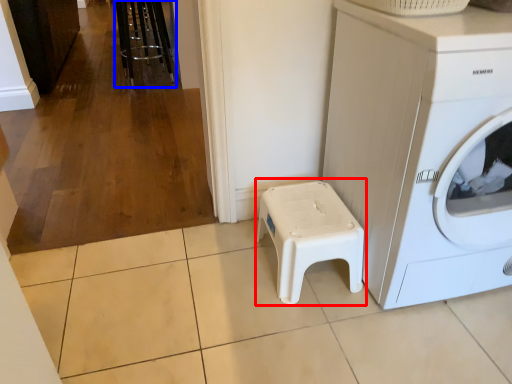
Question: Which of the following is the farthest to the observer, music stool (highlighted by a red box) or bar stool (highlighted by a blue box)?

Choices:
 (A) music stool
 (B) bar stool

Answer: (B)